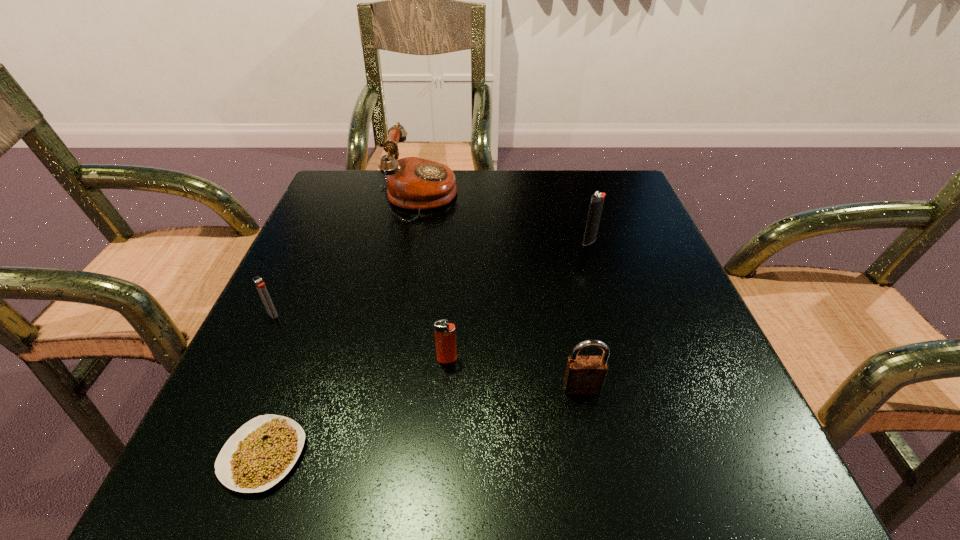
Locate an element on the screen. the shortest object is located at coordinates (260, 453).

The width and height of the screenshot is (960, 540). What are the coordinates of `legume` in the screenshot? It's located at (260, 453).

You are a GUI agent. You are given a task and a screenshot of the screen. Output one action in this format:
    pyautogui.click(x=<x>, y=<y>)
    Task: Click on the free space located 0.400m on the dial of the farthest object
    The width and height of the screenshot is (960, 540).
    Given the screenshot: What is the action you would take?
    pyautogui.click(x=626, y=198)

Find the location of a particular element. vacant space located on the front of the tallest igniter is located at coordinates (620, 345).

The image size is (960, 540). I want to click on free spot located 0.370m on the right of the second igniter from left to right, so click(x=692, y=359).

I want to click on vacant space situated 0.340m on the back of the second farthest igniter, so click(x=325, y=204).

In order to click on vacant region located on the back of the legume in this screenshot , I will do `click(337, 259)`.

Find the location of `object located at the far edge`. object located at the far edge is located at coordinates (414, 183).

Find the location of a particular element. This screenshot has height=540, width=960. object that is at the near edge is located at coordinates (x=260, y=453).

Find the location of a particular element. The width and height of the screenshot is (960, 540). telephone present at the left edge is located at coordinates (414, 183).